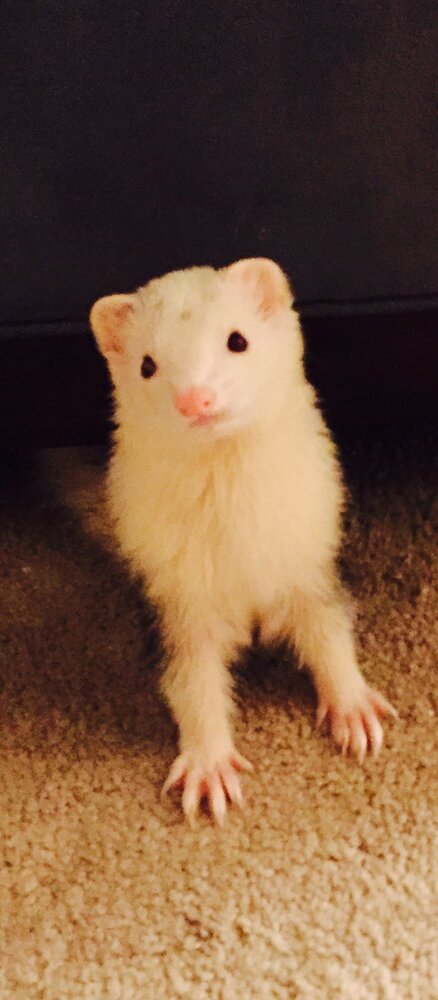
You are a GUI agent. You are given a task and a screenshot of the screen. Output one action in this format:
    pyautogui.click(x=<x>, y=<y>)
    Task: Click on the rug space
    The image size is (438, 1000).
    Given the screenshot: What is the action you would take?
    pyautogui.click(x=390, y=913), pyautogui.click(x=419, y=619), pyautogui.click(x=282, y=776), pyautogui.click(x=157, y=916), pyautogui.click(x=66, y=826)